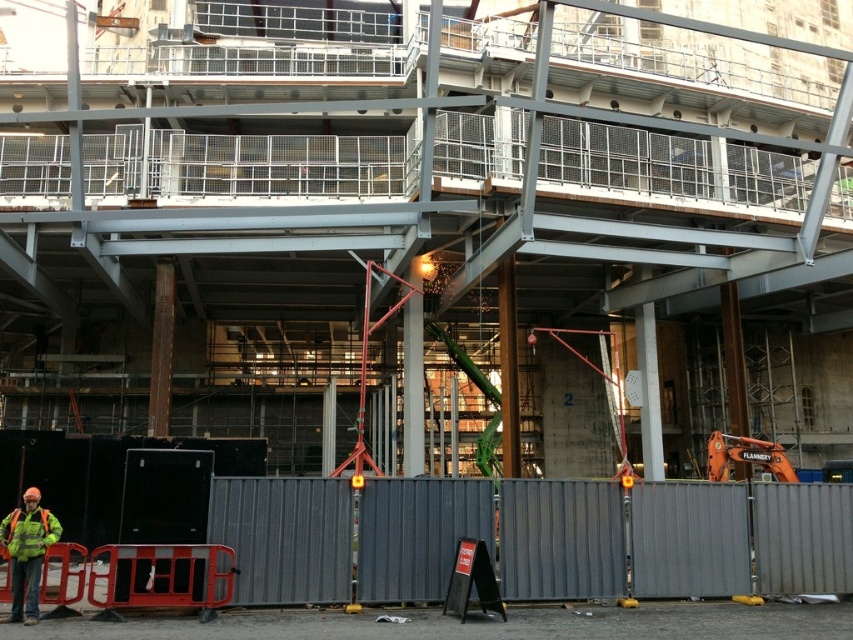
Does gray corrugated fence at center have a lesser width compared to high visibility fabric safety vest at lower left?

No, gray corrugated fence at center is not thinner than high visibility fabric safety vest at lower left.

Is point (686, 592) closer to camera compared to point (22, 516)?

No, it is behind (22, 516).

Which is behind, point (798, 534) or point (3, 529)?

The point (798, 534) is behind.

I want to click on gray corrugated fence at center, so click(x=740, y=538).

What do you see at coordinates (27, 554) in the screenshot? I see `reflective yellow vest at lower left` at bounding box center [27, 554].

Locate an element on the screen. The height and width of the screenshot is (640, 853). reflective yellow vest at lower left is located at coordinates (27, 554).

Is point (717, 561) less distant than point (30, 612)?

No, (717, 561) is further to viewer.

Is gray corrugated fence at center below reflective yellow vest at lower left?

Yes, gray corrugated fence at center is below reflective yellow vest at lower left.

Who is more forward, (619, 512) or (13, 515)?

Positioned in front is point (13, 515).

Where is `gray corrugated fence at center`? The height and width of the screenshot is (640, 853). gray corrugated fence at center is located at coordinates point(740,538).